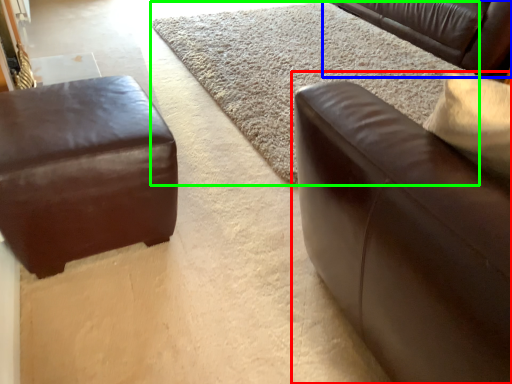
Question: Estimate the real-world distances between objects in this image. Which object is closer to studio couch (highlighted by a red box), studio couch (highlighted by a blue box) or mat (highlighted by a green box)?

Choices:
 (A) studio couch
 (B) mat

Answer: (B)